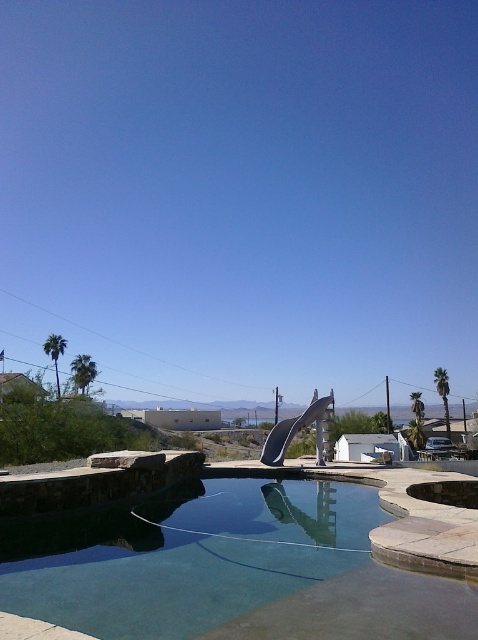
Which is below, clear glass pool at center or metallic silver slide at center?

Positioned lower is metallic silver slide at center.

At what (x,y) coordinates should I click in order to perform the action: click on clear glass pool at center. Please return your answer as a coordinate pair (x, y). Looking at the image, I should click on (187, 556).